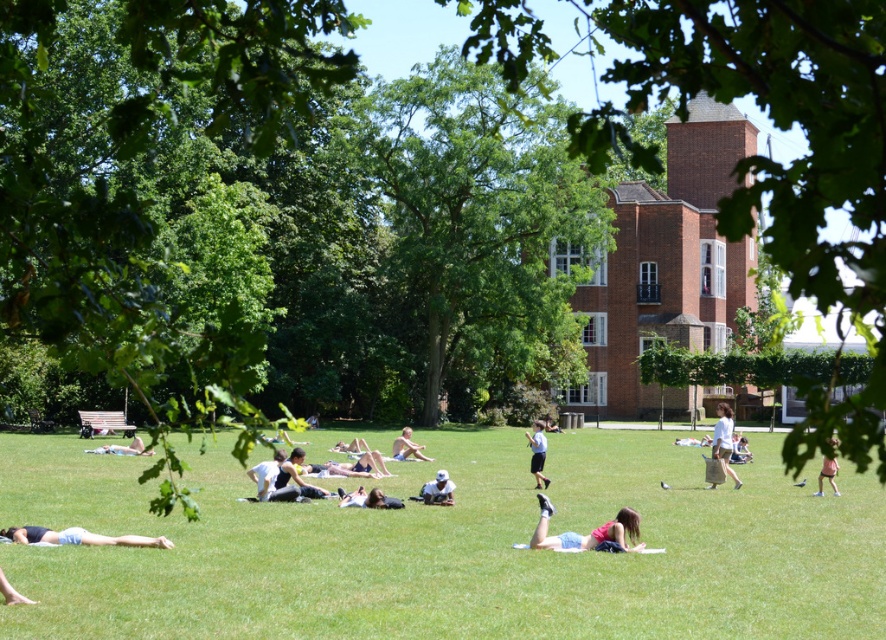
Based on the photo, you are standing in the park and see two fabrics, the pink fabric at center and the dark gray fabric at center. Which fabric is nearer to you?

The pink fabric at center is closer to the viewer than the dark gray fabric at center.

You are standing in the park and want to sit on the light brown wooden bench at center. Which object is closer to you, the green grass at center or the bench?

The green grass at center is closer to the viewer than the light brown wooden bench at center, so the grass is closer to you.